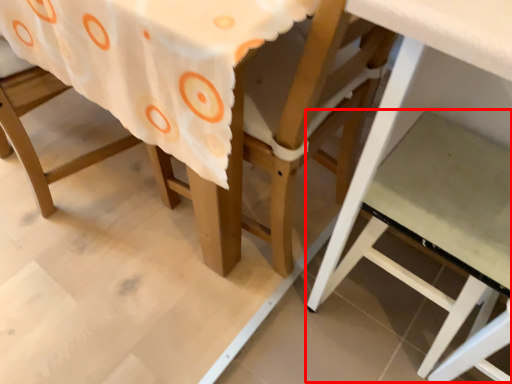
Question: From the image's perspective, where is step stool (annotated by the red box) located in relation to chair in the image?

Choices:
 (A) above
 (B) below

Answer: (B)